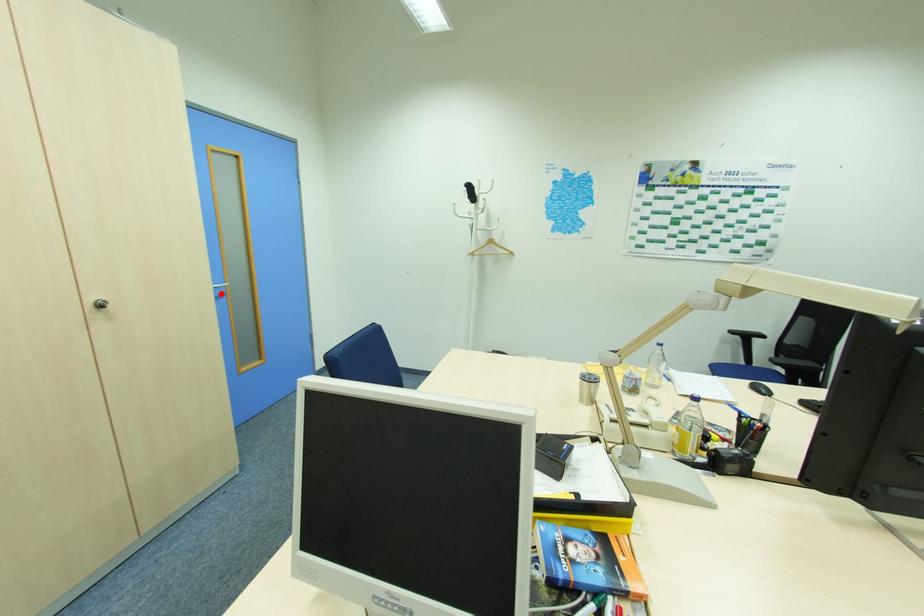
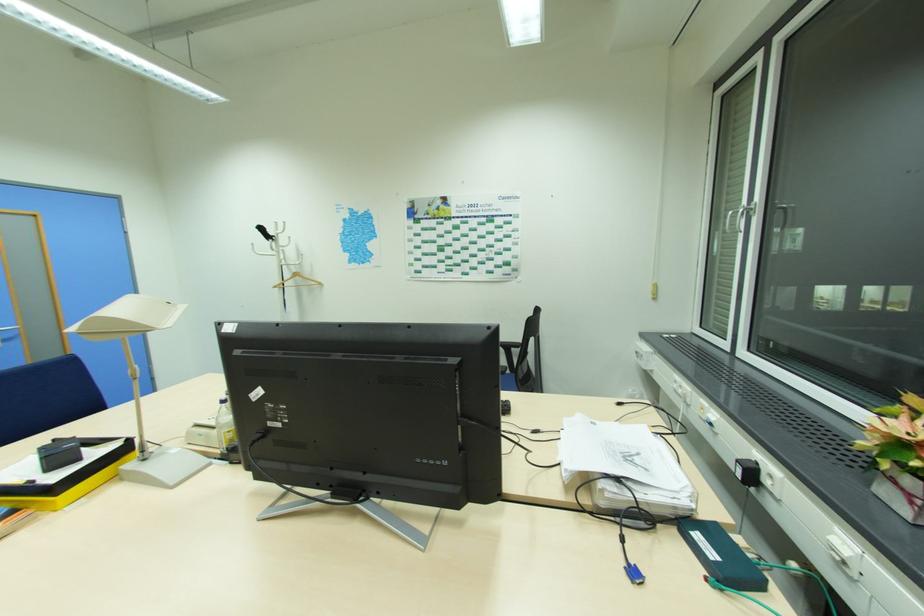
Locate, in the second image, the point that corresponds to the highlighted location in the first image.

(11, 337)